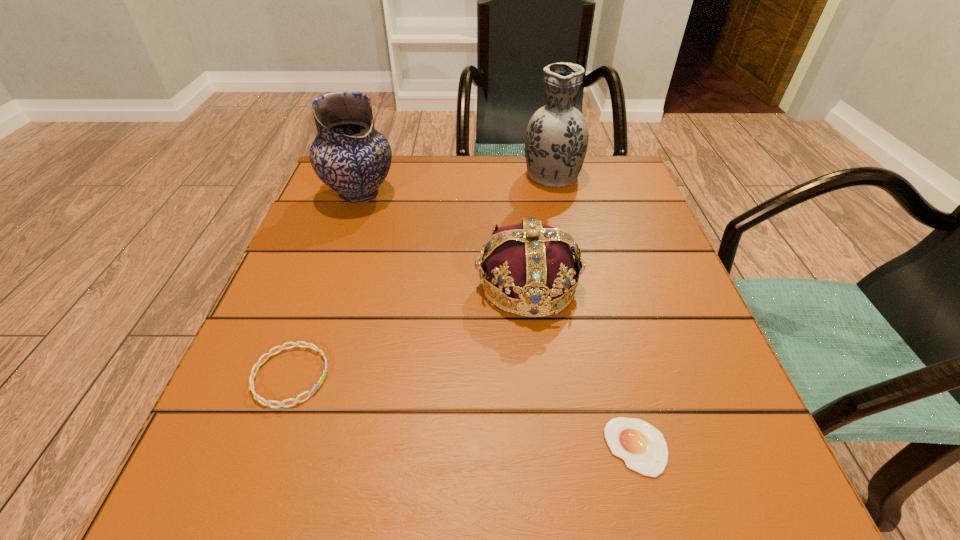
This screenshot has height=540, width=960. Find the location of `the tallest object`. the tallest object is located at coordinates (556, 141).

At what (x,y) coordinates should I click in order to perform the action: click on the second tallest object. Please return your answer as a coordinate pair (x, y). This screenshot has width=960, height=540. Looking at the image, I should click on (349, 155).

The image size is (960, 540). Identify the location of the third nearest object. (534, 263).

The width and height of the screenshot is (960, 540). I want to click on the third shortest object, so click(534, 263).

You are a GUI agent. You are given a task and a screenshot of the screen. Output one action in this format:
    pyautogui.click(x=<x>, y=<y>)
    Task: Click on the second nearest object
    The width and height of the screenshot is (960, 540).
    Given the screenshot: What is the action you would take?
    pyautogui.click(x=309, y=345)

Locate an element on the screen. This screenshot has height=540, width=960. bracelet is located at coordinates pos(309,345).

Locate an element on the screen. The image size is (960, 540). the shortest object is located at coordinates (643, 448).

Locate an element on the screen. The image size is (960, 540). the nearest object is located at coordinates (643, 448).

Locate an element on the screen. The image size is (960, 540). free region located on the front of the pottery is located at coordinates (301, 360).

Find the location of a particular element. free location located 0.340m on the left of the crown is located at coordinates (290, 285).